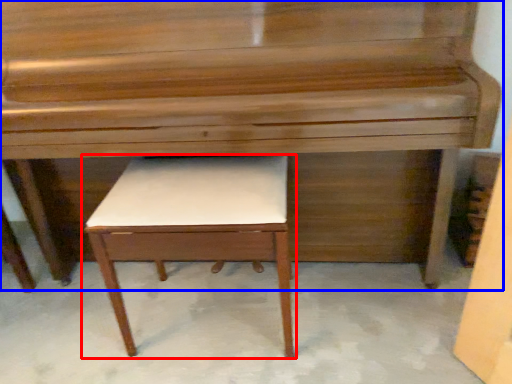
Question: Which point is further to the camera, table (highlighted by a red box) or piano (highlighted by a blue box)?

Choices:
 (A) table
 (B) piano

Answer: (A)